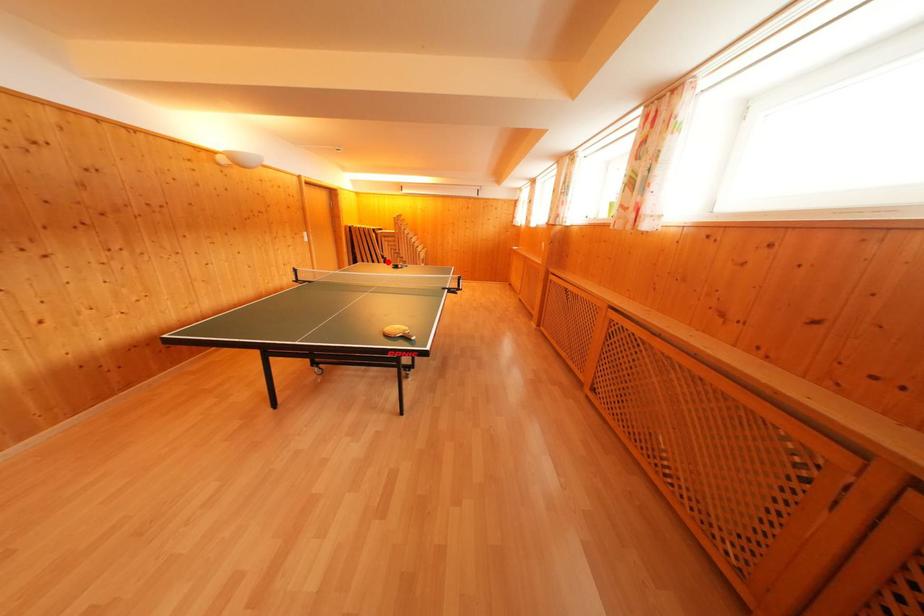
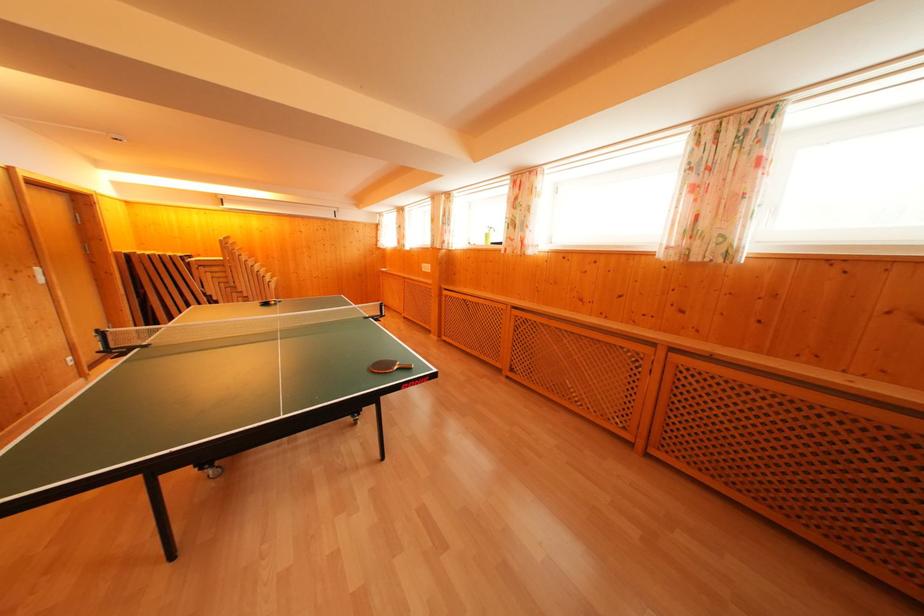
Find the pixel in the second image that matches the highlighted location in the first image.

(210, 300)